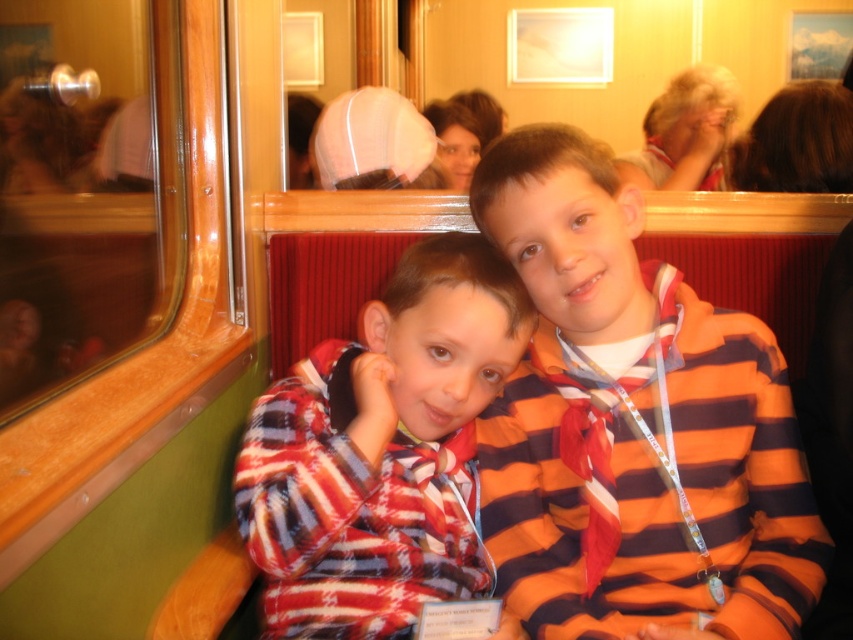
Question: Which object appears farthest from the camera in this image?

Choices:
 (A) striped fleece jacket at center
 (B) striped fabric shirt at center

Answer: (A)

Question: Considering the relative positions of striped fabric shirt at center and striped fleece jacket at center in the image provided, where is striped fabric shirt at center located with respect to striped fleece jacket at center?

Choices:
 (A) above
 (B) below

Answer: (A)

Question: Is striped fabric shirt at center smaller than striped fleece jacket at center?

Choices:
 (A) no
 (B) yes

Answer: (B)

Question: Considering the relative positions of striped fabric shirt at center and striped fleece jacket at center in the image provided, where is striped fabric shirt at center located with respect to striped fleece jacket at center?

Choices:
 (A) right
 (B) left

Answer: (A)

Question: Which object is closer to the camera taking this photo?

Choices:
 (A) striped fabric shirt at center
 (B) striped fleece jacket at center

Answer: (A)

Question: Which of the following is the closest to the observer?

Choices:
 (A) (283, 556)
 (B) (618, 582)

Answer: (A)